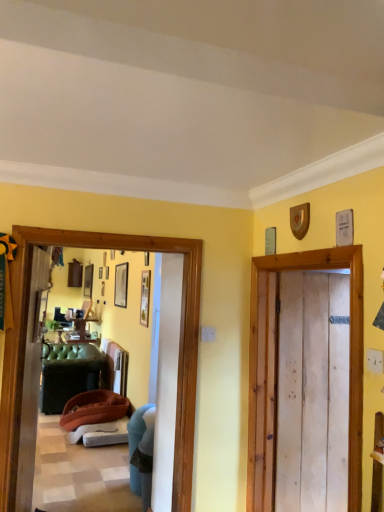
Question: Does matte black picture frame at upper center, the 1th picture frame positioned from the left, contain wooden picture frame at center, positioned as the first picture frame in right-to-left order?

Choices:
 (A) yes
 (B) no

Answer: (B)

Question: Is matte black picture frame at upper center, which is the 2th picture frame from right to left, bigger than wooden picture frame at center, which is the second picture frame in back-to-front order?

Choices:
 (A) no
 (B) yes

Answer: (B)

Question: Does matte black picture frame at upper center, which is the 2th picture frame from right to left, come behind wooden picture frame at center, which is the 1th picture frame from front to back?

Choices:
 (A) yes
 (B) no

Answer: (A)

Question: Does matte black picture frame at upper center, the 1th picture frame positioned from the left, turn towards wooden picture frame at center, which is the 1th picture frame from front to back?

Choices:
 (A) no
 (B) yes

Answer: (A)

Question: Can you confirm if matte black picture frame at upper center, the 2th picture frame viewed from the front, is wider than wooden picture frame at center, which is the 1th picture frame from front to back?

Choices:
 (A) no
 (B) yes

Answer: (B)

Question: Is matte black picture frame at upper center, acting as the first picture frame starting from the back, taller than wooden picture frame at center, which is the 1th picture frame from front to back?

Choices:
 (A) yes
 (B) no

Answer: (A)

Question: From a real-world perspective, does brown fabric couch at left stand above matte black picture frame at upper center, which is the 2th picture frame from right to left?

Choices:
 (A) yes
 (B) no

Answer: (B)

Question: Is brown fabric couch at left not inside matte black picture frame at upper center, which is the 2th picture frame from right to left?

Choices:
 (A) no
 (B) yes

Answer: (B)

Question: Considering the relative positions of brown fabric couch at left and matte black picture frame at upper center, the 1th picture frame positioned from the left, in the image provided, is brown fabric couch at left to the right of matte black picture frame at upper center, the 1th picture frame positioned from the left, from the viewer's perspective?

Choices:
 (A) yes
 (B) no

Answer: (B)

Question: From the image's perspective, is brown fabric couch at left located beneath matte black picture frame at upper center, the 2th picture frame viewed from the front?

Choices:
 (A) yes
 (B) no

Answer: (A)

Question: Does brown fabric couch at left have a greater height compared to matte black picture frame at upper center, acting as the first picture frame starting from the back?

Choices:
 (A) yes
 (B) no

Answer: (B)

Question: Can you confirm if brown fabric couch at left is positioned to the left of matte black picture frame at upper center, the 2th picture frame viewed from the front?

Choices:
 (A) no
 (B) yes

Answer: (B)

Question: From a real-world perspective, is brown fabric couch at left beneath wooden picture frame at center, which is the 1th picture frame from front to back?

Choices:
 (A) no
 (B) yes

Answer: (B)